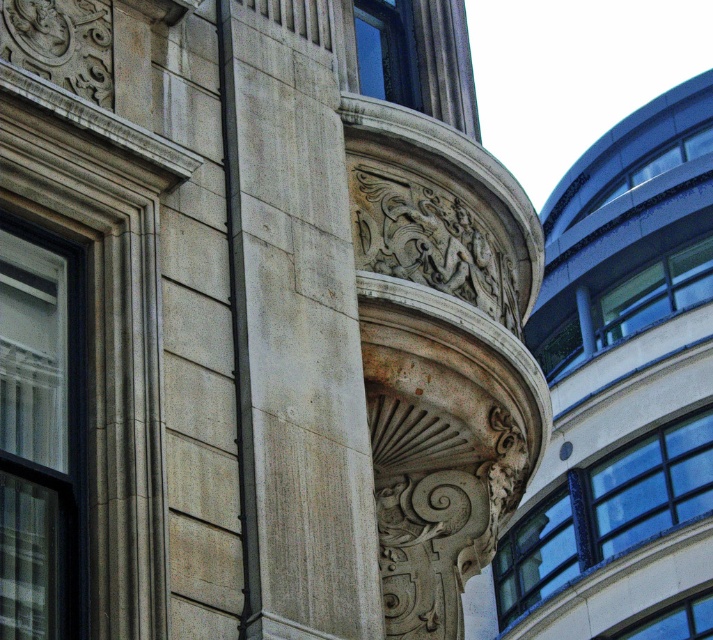
In the scene shown: Is smooth concrete tower at center below light gray stone column at center?

Yes, smooth concrete tower at center is below light gray stone column at center.

Is point (589, 506) positioned in front of point (322, 540)?

No, it is not.

Find the location of `smooth concrete tower at center`. smooth concrete tower at center is located at coordinates (622, 388).

Between smooth concrete tower at center and black metal pole at center, which one appears on the right side from the viewer's perspective?

smooth concrete tower at center is more to the right.

Who is lower down, smooth concrete tower at center or black metal pole at center?

smooth concrete tower at center is below.

What do you see at coordinates (622, 388) in the screenshot? This screenshot has width=713, height=640. I see `smooth concrete tower at center` at bounding box center [622, 388].

Find the location of a particular element. Image resolution: width=713 pixels, height=640 pixels. smooth concrete tower at center is located at coordinates (622, 388).

Is light gray stone column at center positioned in front of black metal pole at center?

Yes, it is.

Does light gray stone column at center lie behind black metal pole at center?

No, it is not.

Locate an element on the screen. The image size is (713, 640). light gray stone column at center is located at coordinates (294, 328).